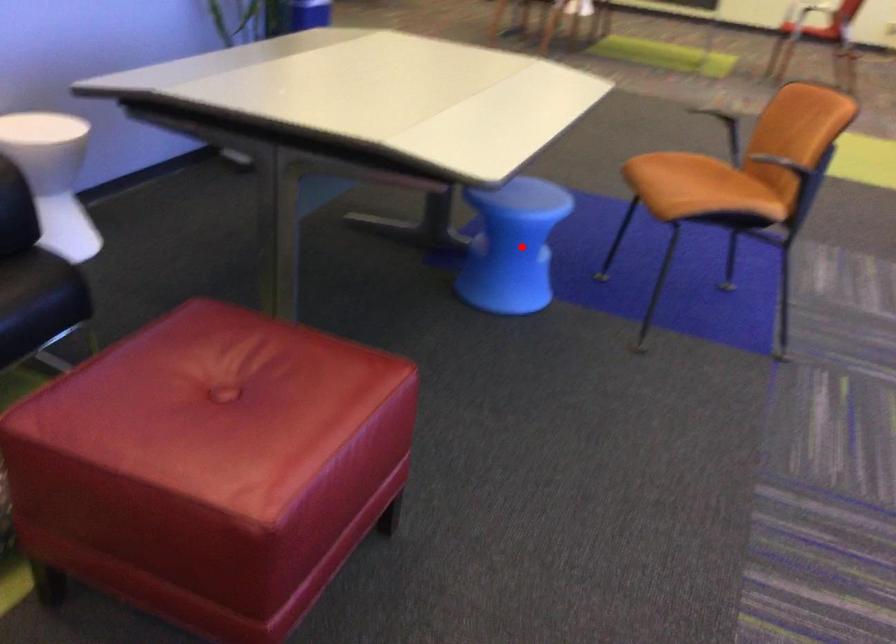
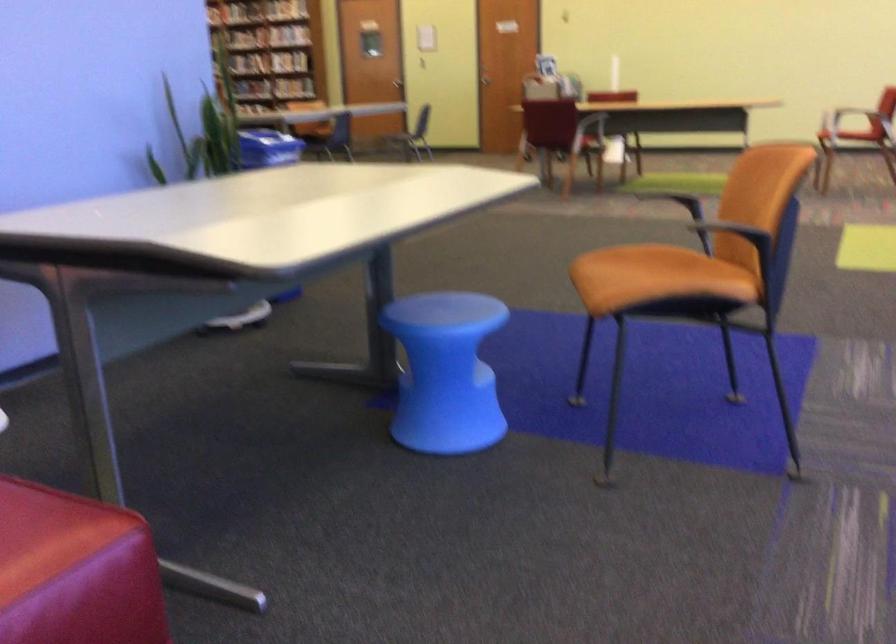
Question: A red point is marked in image1. In image2, is the corresponding 3D point closer to the camera or farther? Reply with the corresponding letter.

Choices:
 (A) The corresponding 3D point is closer.
 (B) The corresponding 3D point is farther.

Answer: (A)